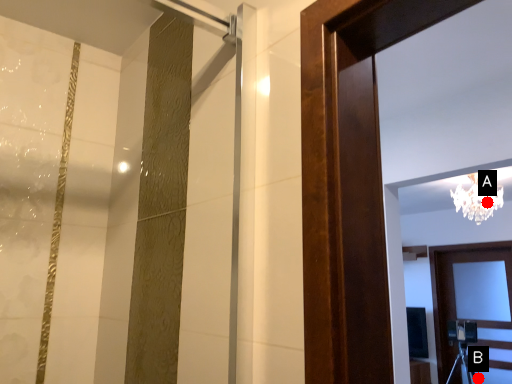
Question: Two points are circled on the image, labeled by A and B beside each circle. Which point appears farthest from the camera in this image?

Choices:
 (A) A is further
 (B) B is further

Answer: (B)